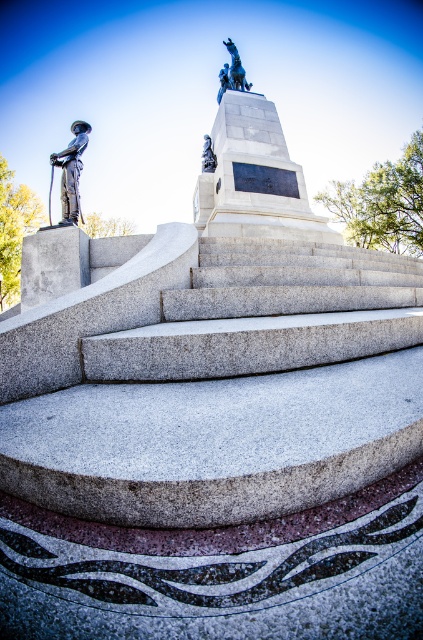
You are standing at the base of the monument and want to take a photo of both statues. The soldier statue is at point (x=231, y=70) and the rider statue is at point (x=205, y=138). Which statue should you focus on first to ensure both are in frame?

You should focus on the soldier statue at point (x=231, y=70) first because it is in front of the rider statue at point (x=205, y=138), ensuring both will be visible in the photo.

In the scene shown: You are standing at the center of the monument steps. Which direction should you walk to reach the bronze statue at left?

You should walk to the left to reach the bronze statue at left since it is positioned on the left side of the steps.